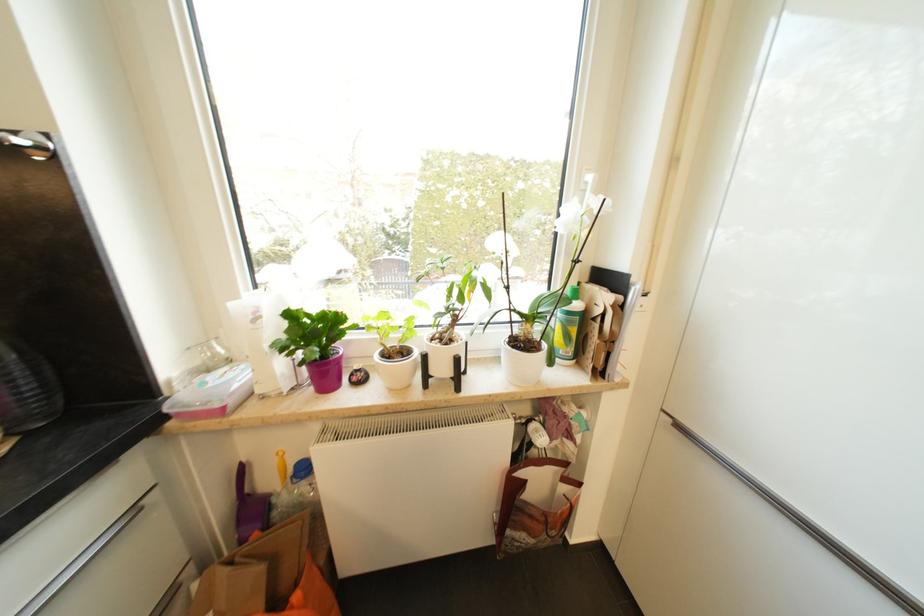
The height and width of the screenshot is (616, 924). Describe the element at coordinates (79, 562) in the screenshot. I see `a silver drawer handle` at that location.